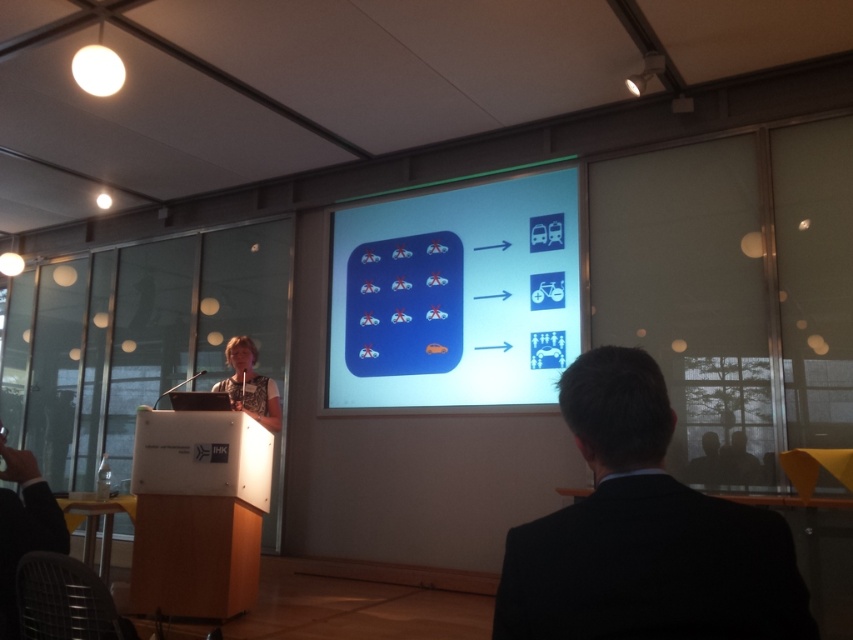
Question: Which object is closer to the camera taking this photo?

Choices:
 (A) black suit at center
 (B) white glossy projection screen at center
 (C) light beige shirt at left

Answer: (A)

Question: Which point is closer to the camera?

Choices:
 (A) light beige shirt at left
 (B) white glossy projection screen at center
 (C) black suit at center

Answer: (C)

Question: Does black suit at center appear under light beige shirt at left?

Choices:
 (A) no
 (B) yes

Answer: (A)

Question: Is black suit at center to the right of light beige shirt at left from the viewer's perspective?

Choices:
 (A) yes
 (B) no

Answer: (A)

Question: Where is black suit at center located in relation to light beige shirt at left in the image?

Choices:
 (A) left
 (B) right

Answer: (B)

Question: Which of the following is the farthest from the observer?

Choices:
 (A) (247, 381)
 (B) (506, 339)
 (C) (676, 634)

Answer: (B)